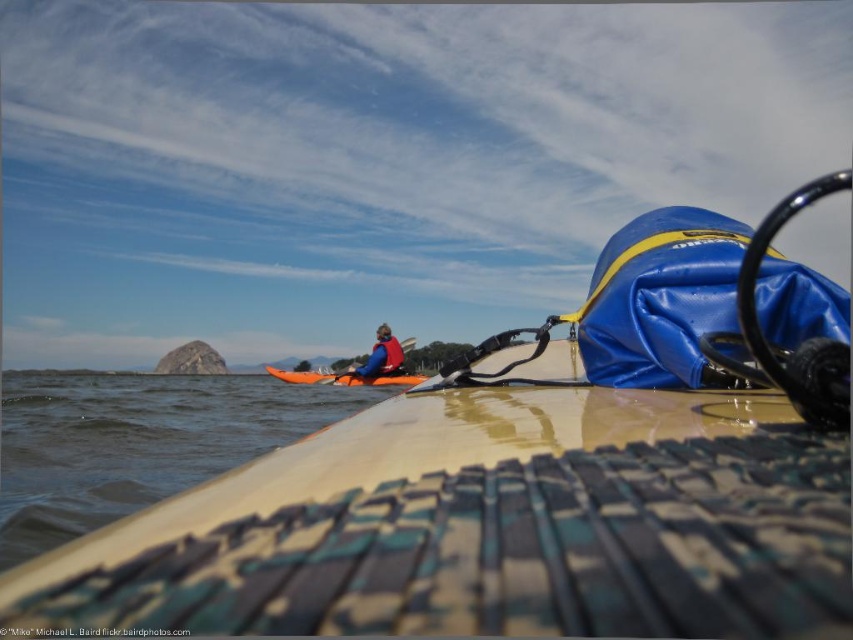
You are planning to take a photo of the matte yellow kayak at center and the clear water at lower left. Which object should you focus on first if you want to capture both in the same frame without moving the camera?

The matte yellow kayak at center is smaller in size compared to the clear water at lower left, so you should focus on the matte yellow kayak at center first to ensure it is in focus before the larger area of clear water at lower left.

You are on a paddleboard and see the matte yellow kayak at center and the clear water at lower left. Which object is closer to you?

The matte yellow kayak at center is closer to you because it is positioned in front of the clear water at lower left.